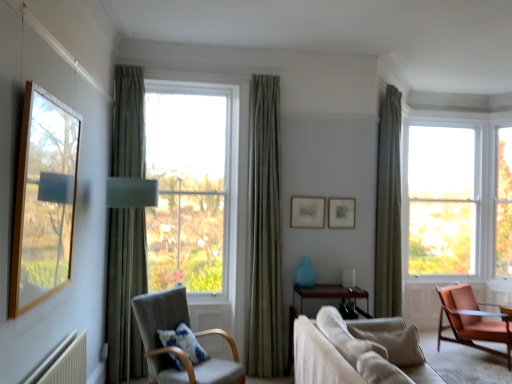
Question: Considering the positions of light gray fabric chair at center-left, which appears as the 2th chair when viewed from the right, and teal matte vase at center in the image, is light gray fabric chair at center-left, which appears as the 2th chair when viewed from the right, wider or thinner than teal matte vase at center?

Choices:
 (A) thin
 (B) wide

Answer: (B)

Question: Considering their positions, is light gray fabric chair at center-left, which appears as the 2th chair when viewed from the right, located in front of or behind teal matte vase at center?

Choices:
 (A) behind
 (B) front

Answer: (B)

Question: Considering the real-world distances, which object is farthest from the clear glass window at right, the first window from the right?

Choices:
 (A) blue textured pillow at center, which ranks as the 2th pillow in right-to-left order
 (B) light gray fabric chair at center-left, which appears as the 2th chair when viewed from the right
 (C) teal matte vase at center
 (D) green velvet curtain at left, the 3th curtain when ordered from back to front
 (E) matte blue glass table lamp at center

Answer: (D)

Question: Which is farther from the clear glass window at center, the 1th window viewed from the left?

Choices:
 (A) green fabric curtain at right, which is the first curtain in back-to-front order
 (B) teal matte vase at center
 (C) green textured curtain at center, arranged as the 2th curtain when viewed from the back
 (D) light gray fabric chair at center-left, which appears as the 1th chair when viewed from the left
 (E) matte wooden picture frame at center, acting as the second picture frame starting from the right

Answer: (A)